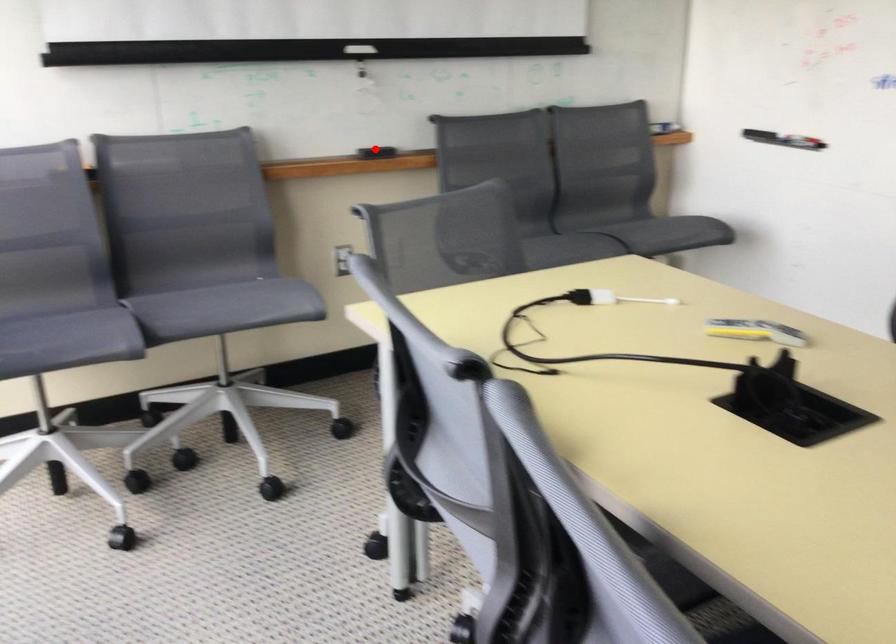
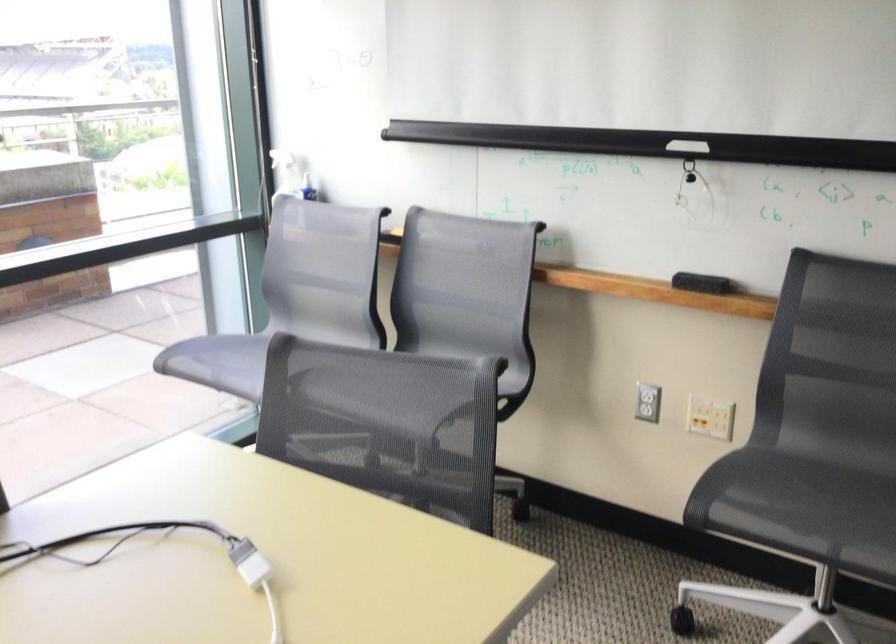
Find the pixel in the second image that matches the highlighted location in the first image.

(701, 283)